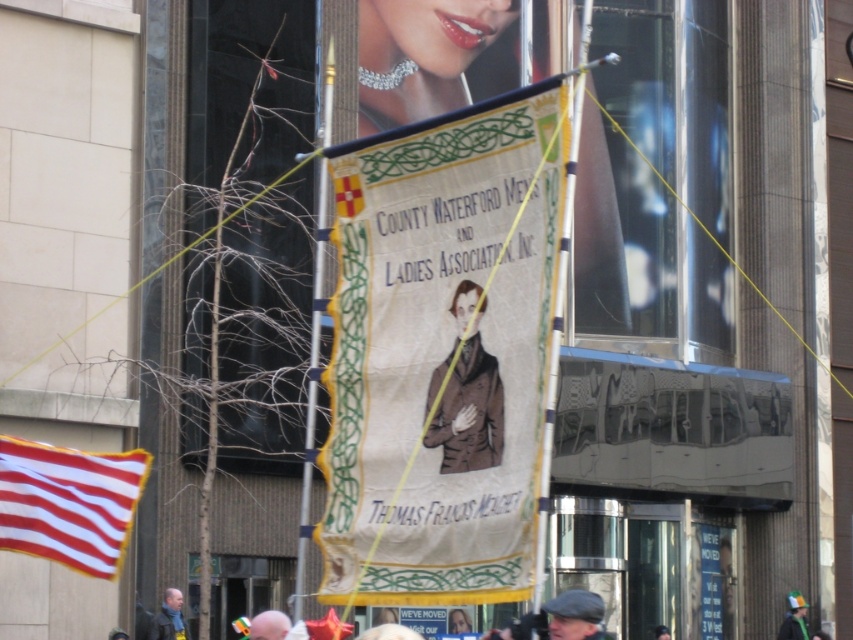
Question: Where is red and white striped fabric at left located in relation to light brown hair at lower center in the image?

Choices:
 (A) left
 (B) right

Answer: (A)

Question: Does red and white striped fabric at left appear over light brown hair at lower center?

Choices:
 (A) no
 (B) yes

Answer: (B)

Question: Which of these objects is positioned closest to the dark blue scarf at lower left?

Choices:
 (A) light brown hair at lower center
 (B) red and white striped fabric at left
 (C) beige fabric banner at center
 (D) brown textured coat at center

Answer: (A)

Question: Which point is closer to the camera taking this photo?

Choices:
 (A) (531, 276)
 (B) (148, 632)

Answer: (A)

Question: Is dark blue scarf at lower left positioned in front of green fabric hat at center?

Choices:
 (A) yes
 (B) no

Answer: (A)

Question: Which point is closer to the camera?

Choices:
 (A) green fabric hat at center
 (B) beige fabric banner at center
 (C) dark blue scarf at lower left

Answer: (B)